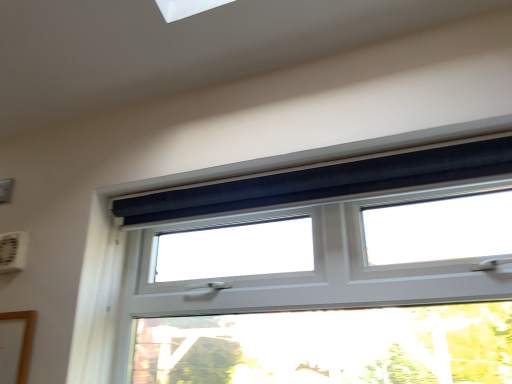
Question: In terms of height, does black velvet curtain at upper center look taller or shorter compared to white plastic air conditioning unit at upper left?

Choices:
 (A) tall
 (B) short

Answer: (A)

Question: Is point (131, 289) closer or farther from the camera than point (15, 241)?

Choices:
 (A) farther
 (B) closer

Answer: (A)

Question: In terms of width, does black velvet curtain at upper center look wider or thinner when compared to white plastic air conditioning unit at upper left?

Choices:
 (A) thin
 (B) wide

Answer: (B)

Question: In the image, is white plastic air conditioning unit at upper left positioned in front of or behind black velvet curtain at upper center?

Choices:
 (A) behind
 (B) front

Answer: (A)

Question: From the image's perspective, is white plastic air conditioning unit at upper left located above or below black velvet curtain at upper center?

Choices:
 (A) above
 (B) below

Answer: (A)

Question: Is white plastic air conditioning unit at upper left bigger or smaller than black velvet curtain at upper center?

Choices:
 (A) small
 (B) big

Answer: (A)

Question: Is white plastic air conditioning unit at upper left situated inside black velvet curtain at upper center or outside?

Choices:
 (A) outside
 (B) inside

Answer: (A)